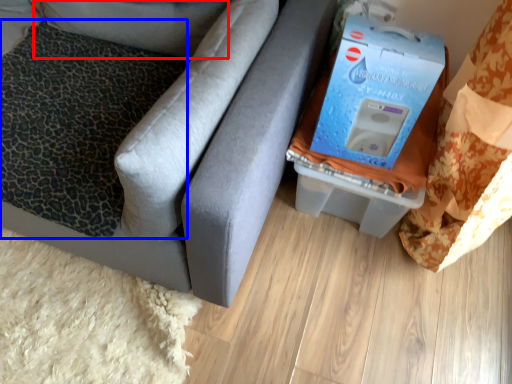
Question: Which point is further to the camera, pillow (highlighted by a red box) or pillow (highlighted by a blue box)?

Choices:
 (A) pillow
 (B) pillow

Answer: (A)